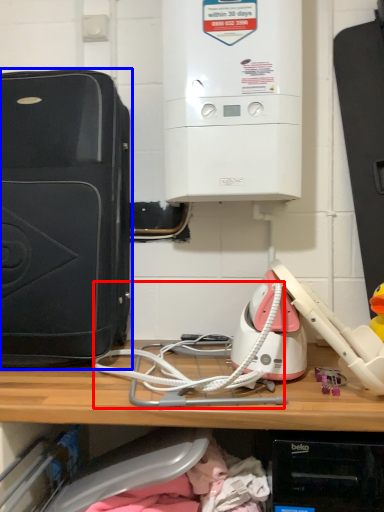
Question: Which object appears farthest to the camera in this image, wire (highlighted by a red box) or home appliance (highlighted by a blue box)?

Choices:
 (A) wire
 (B) home appliance

Answer: (B)